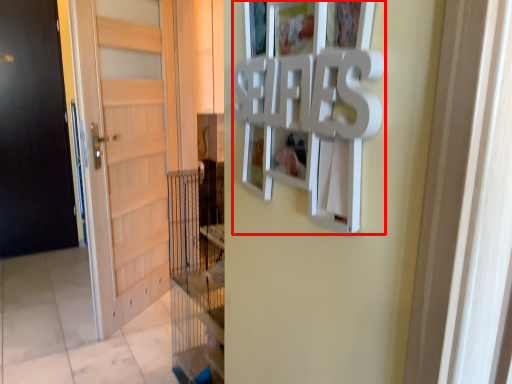
Question: In this image, where is picture frame (annotated by the red box) located relative to door?

Choices:
 (A) right
 (B) left

Answer: (A)